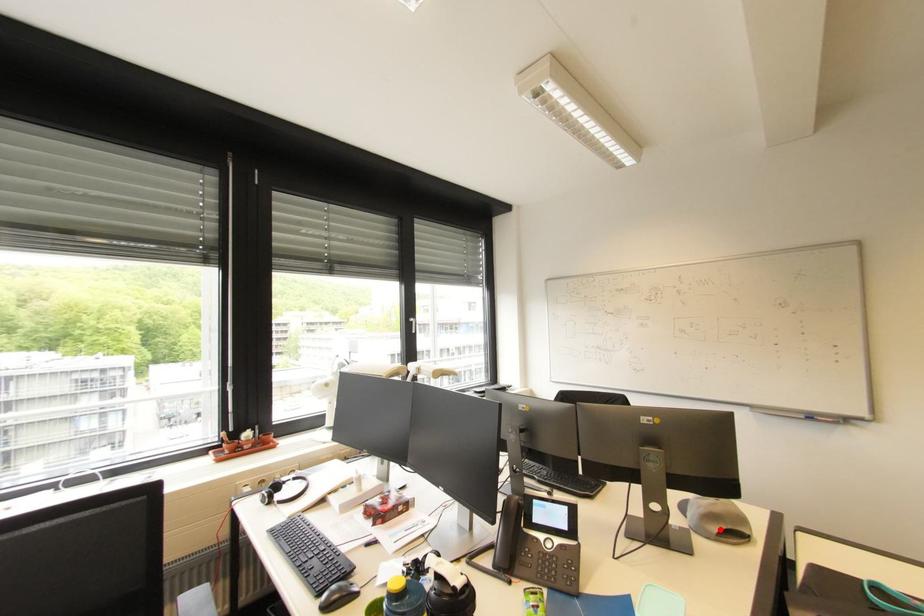
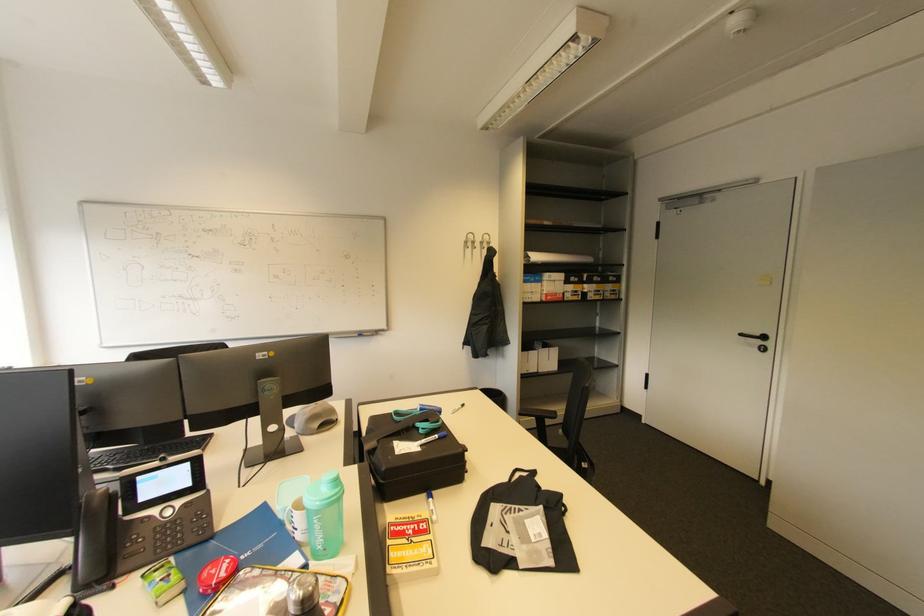
Locate, in the second image, the point that corresponds to the highlighted location in the first image.

(321, 426)